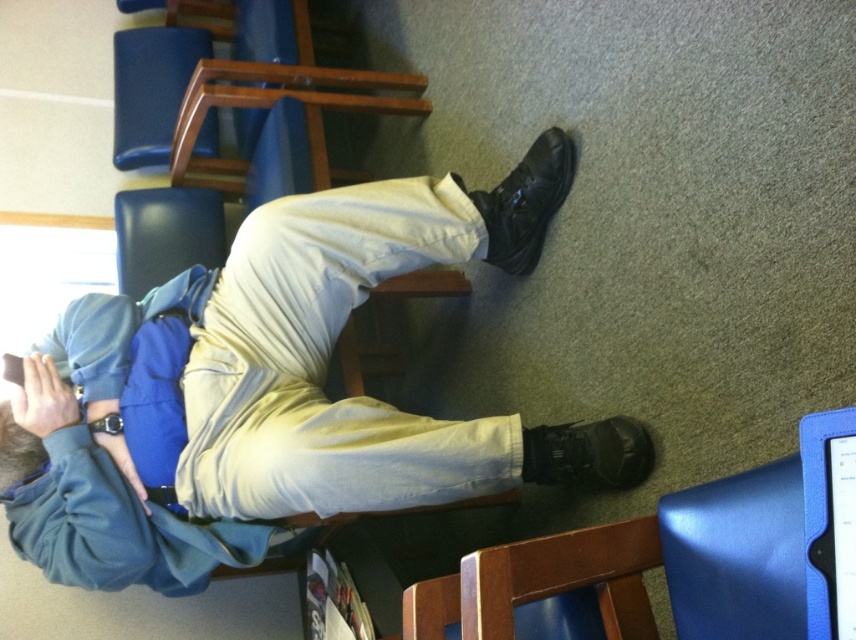
Question: From the image, what is the correct spatial relationship of blue leather tablet at lower right in relation to black leather shoe at lower right?

Choices:
 (A) left
 (B) right

Answer: (B)

Question: Which point is farther to the camera?

Choices:
 (A) blue leather tablet at lower right
 (B) black leather shoe at lower right

Answer: (B)

Question: Does matte black shoe at lower right have a greater width compared to blue leather tablet at lower right?

Choices:
 (A) no
 (B) yes

Answer: (B)

Question: Among these points, which one is nearest to the camera?

Choices:
 (A) (12, 486)
 (B) (530, 182)
 (C) (830, 445)
 (D) (566, 428)

Answer: (C)

Question: Estimate the real-world distances between objects in this image. Which object is farther from the matte black shoe at lower right?

Choices:
 (A) blue leather tablet at lower right
 (B) matte black hair at lower left
 (C) black leather shoe at lower right

Answer: (A)

Question: Considering the relative positions of black leather shoe at lower right and matte black hair at lower left in the image provided, where is black leather shoe at lower right located with respect to matte black hair at lower left?

Choices:
 (A) above
 (B) below

Answer: (A)